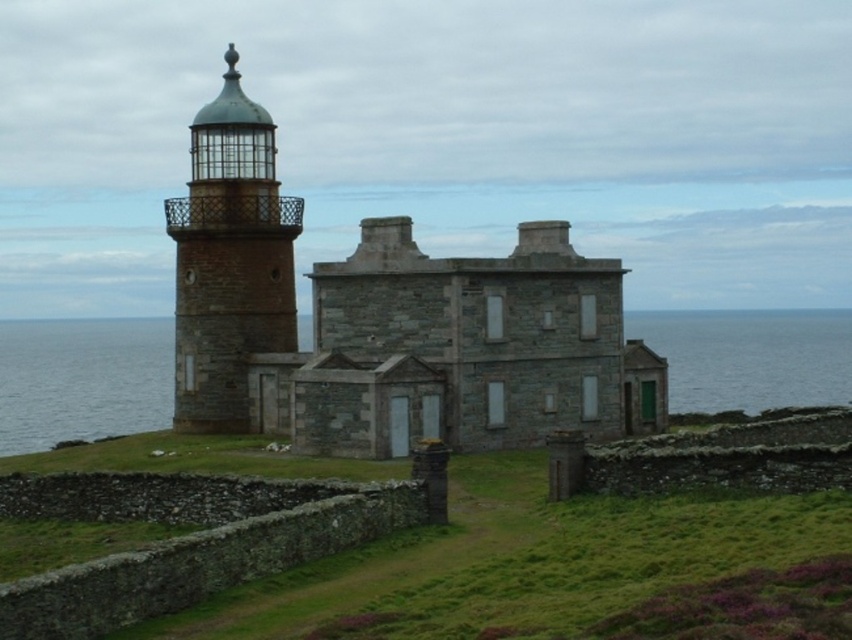
You are a tourist standing on the cliff and want to take a photo of both the stone building at left and the rustic stone lighthouse at left. Which one should you zoom in on more to ensure both fit in the frame?

The stone building at left is larger than the rustic stone lighthouse at left, so you should zoom in more on the rustic stone lighthouse at left to ensure both fit in the frame.

You are standing at the base of the historic stone structure in the coastal scene. If you look towards the point marked at coordinates (369, 548), what would you see?

The point at coordinates (369, 548) corresponds to green grassy at center, so you would see green grassy at center.

You are standing at the base of the lighthouse and see two points marked in the image. The first point is at coordinates point (217, 580) and the second is at point (176, 288). Which point is closer to you?

Point (217, 580) is in front of point (176, 288), so it is closer to you.